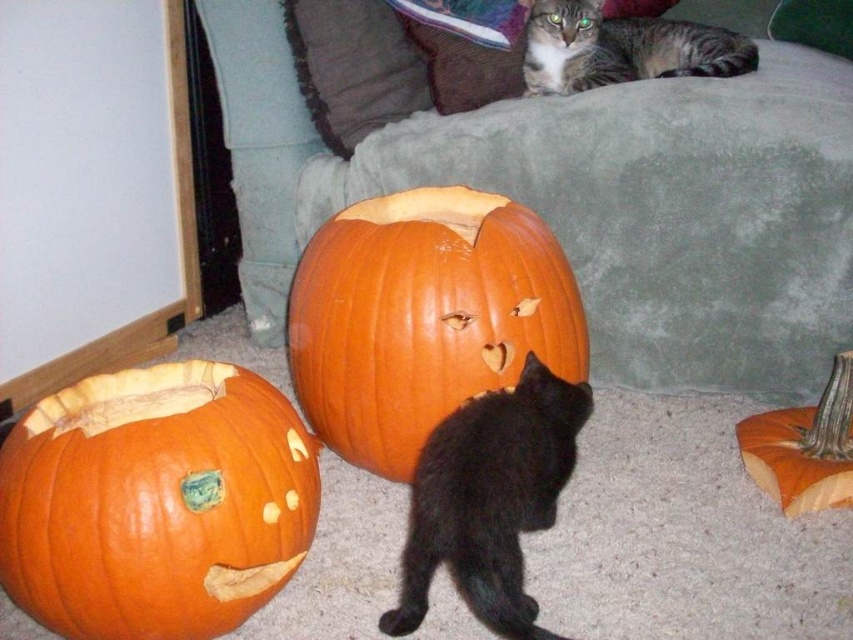
You are standing in the room and see two points marked in the scene. Which point, point (409, 285) or point (508, 454), is closer to you?

Point (409, 285) is closer to you because it is further to the viewer than point (508, 454).

You are standing at the center of the room and see an orange matte pumpkin at center. Can you tell me what is located exactly at the point with coordinates (424,316)?

The orange matte pumpkin at center is located exactly at the point with coordinates (424,316).